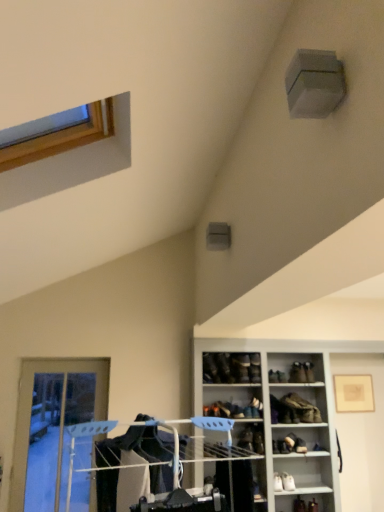
Question: From the image's perspective, is matte gold picture frame at upper right located above or below black leather shoe at center, which is the 2th shoe in top-to-bottom order?

Choices:
 (A) above
 (B) below

Answer: (B)

Question: Considering the positions of matte gold picture frame at upper right and black leather shoe at center, the 4th shoe viewed from the right, in the image, is matte gold picture frame at upper right bigger or smaller than black leather shoe at center, the 4th shoe viewed from the right,?

Choices:
 (A) small
 (B) big

Answer: (A)

Question: Based on their relative distances, which object is nearer to the matte black shoe at upper right, the second shoe when ordered from bottom to top?

Choices:
 (A) transparent glass door at lower left
 (B) white leather shoe at lower right, the 3th footwear positioned from the top
 (C) leather boot at lower right, which ranks as the second footwear in bottom-to-top order
 (D) matte gold picture frame at upper right
 (E) white glossy cabinet at lower right

Answer: (C)

Question: Considering the real-world distances, which object is closest to the black leather shoe at center, placed as the 3th shoe when sorted from bottom to top?

Choices:
 (A) white glossy cabinet at lower right
 (B) transparent glass door at lower left
 (C) leather boot at center, the 1th footwear when ordered from top to bottom
 (D) matte black shoe at upper center, which ranks as the second shoe in left-to-right order
 (E) matte black shoe at upper right, the 2th shoe viewed from the right

Answer: (D)